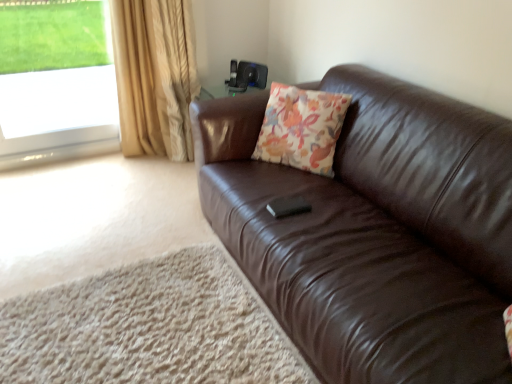
Question: Considering the relative positions of brown leather couch at right and transparent glass window at upper left in the image provided, is brown leather couch at right to the right of transparent glass window at upper left from the viewer's perspective?

Choices:
 (A) yes
 (B) no

Answer: (A)

Question: Is brown leather couch at right positioned in front of transparent glass window at upper left?

Choices:
 (A) yes
 (B) no

Answer: (A)

Question: Is brown leather couch at right bigger than transparent glass window at upper left?

Choices:
 (A) no
 (B) yes

Answer: (B)

Question: Is brown leather couch at right at the left side of transparent glass window at upper left?

Choices:
 (A) yes
 (B) no

Answer: (B)

Question: Is brown leather couch at right not inside transparent glass window at upper left?

Choices:
 (A) no
 (B) yes

Answer: (B)

Question: Does brown leather couch at right turn towards transparent glass window at upper left?

Choices:
 (A) no
 (B) yes

Answer: (A)

Question: Does gold textured curtain at left have a greater height compared to brown leather couch at right?

Choices:
 (A) no
 (B) yes

Answer: (B)

Question: Could you tell me if gold textured curtain at left is facing brown leather couch at right?

Choices:
 (A) no
 (B) yes

Answer: (B)

Question: Is the position of gold textured curtain at left more distant than that of brown leather couch at right?

Choices:
 (A) yes
 (B) no

Answer: (A)

Question: From a real-world perspective, is gold textured curtain at left physically below brown leather couch at right?

Choices:
 (A) yes
 (B) no

Answer: (B)

Question: Is gold textured curtain at left located outside brown leather couch at right?

Choices:
 (A) yes
 (B) no

Answer: (A)

Question: From the image's perspective, would you say gold textured curtain at left is shown under brown leather couch at right?

Choices:
 (A) no
 (B) yes

Answer: (A)

Question: From the image's perspective, is brown leather couch at right on floral fabric cushion at center?

Choices:
 (A) yes
 (B) no

Answer: (B)